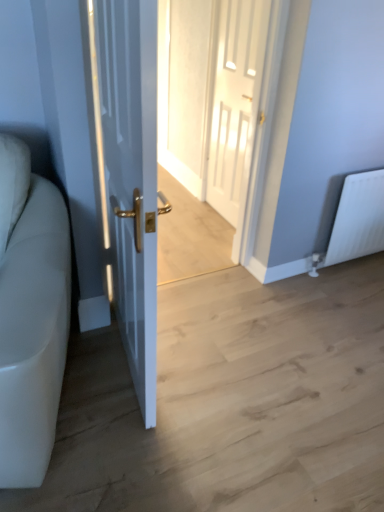
Question: Could you tell me if white glossy door at center, the 2th door when ordered from front to back, is facing white glossy door at left, the first door positioned from the front?

Choices:
 (A) yes
 (B) no

Answer: (B)

Question: Can you confirm if white glossy door at center, the 2th door when ordered from front to back, is bigger than white glossy door at left, the first door positioned from the front?

Choices:
 (A) no
 (B) yes

Answer: (A)

Question: Is white glossy door at center, the first door viewed from the right, closer to camera compared to white glossy door at left, the 2th door in the back-to-front sequence?

Choices:
 (A) yes
 (B) no

Answer: (B)

Question: Considering the relative sizes of white glossy door at center, arranged as the second door when viewed from the left, and white glossy door at left, the 2th door in the back-to-front sequence, in the image provided, is white glossy door at center, arranged as the second door when viewed from the left, wider than white glossy door at left, the 2th door in the back-to-front sequence,?

Choices:
 (A) yes
 (B) no

Answer: (B)

Question: Is white glossy door at center, which is the first door in back-to-front order, behind white glossy door at left, the 2th door in the back-to-front sequence?

Choices:
 (A) yes
 (B) no

Answer: (A)

Question: Considering the positions of white leather couch at left and white matte radiator at right in the image, is white leather couch at left wider or thinner than white matte radiator at right?

Choices:
 (A) thin
 (B) wide

Answer: (B)

Question: Considering the relative positions of white leather couch at left and white matte radiator at right in the image provided, is white leather couch at left to the left or to the right of white matte radiator at right?

Choices:
 (A) left
 (B) right

Answer: (A)

Question: Is white leather couch at left spatially inside white matte radiator at right, or outside of it?

Choices:
 (A) inside
 (B) outside

Answer: (B)

Question: From the image's perspective, is white leather couch at left positioned above or below white matte radiator at right?

Choices:
 (A) above
 (B) below

Answer: (B)

Question: Is white glossy door at left, positioned as the first door in left-to-right order, spatially inside white glossy door at center, or outside of it?

Choices:
 (A) inside
 (B) outside

Answer: (B)

Question: Visually, is white glossy door at left, positioned as the first door in left-to-right order, positioned to the left or to the right of white glossy door at center?

Choices:
 (A) left
 (B) right

Answer: (A)

Question: In the image, is white glossy door at left, which is the second door from right to left, positioned in front of or behind white glossy door at center?

Choices:
 (A) behind
 (B) front

Answer: (B)

Question: Looking at their shapes, would you say white glossy door at left, the 2th door in the back-to-front sequence, is wider or thinner than white glossy door at center?

Choices:
 (A) thin
 (B) wide

Answer: (B)

Question: In the image, is white matte radiator at right on the left side or the right side of white glossy door at left, the first door positioned from the front?

Choices:
 (A) right
 (B) left

Answer: (A)

Question: In the image, is white matte radiator at right positioned in front of or behind white glossy door at left, which is the second door from right to left?

Choices:
 (A) behind
 (B) front

Answer: (A)